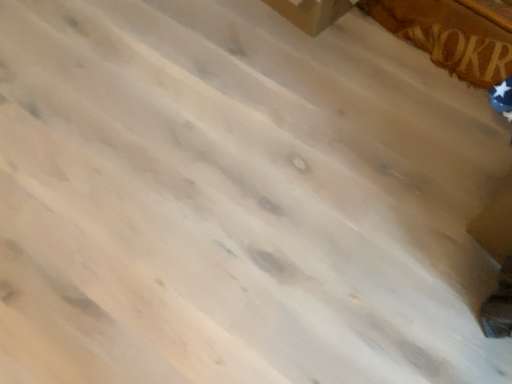
The height and width of the screenshot is (384, 512). Describe the element at coordinates (462, 52) in the screenshot. I see `gold fabric banner at upper right` at that location.

The height and width of the screenshot is (384, 512). Identify the location of gold fabric banner at upper right. (462, 52).

Where is `gold fabric banner at upper right`? The image size is (512, 384). gold fabric banner at upper right is located at coordinates (462, 52).